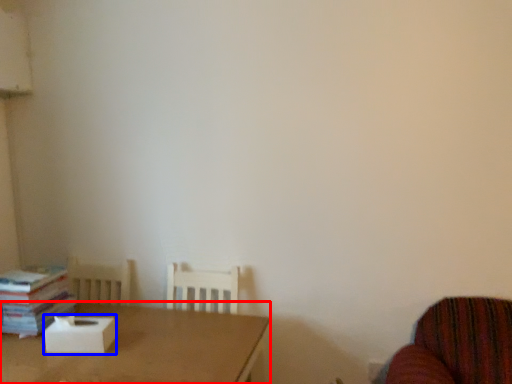
Question: Which point is closer to the camera, table (highlighted by a red box) or cardboard box (highlighted by a blue box)?

Choices:
 (A) table
 (B) cardboard box

Answer: (A)